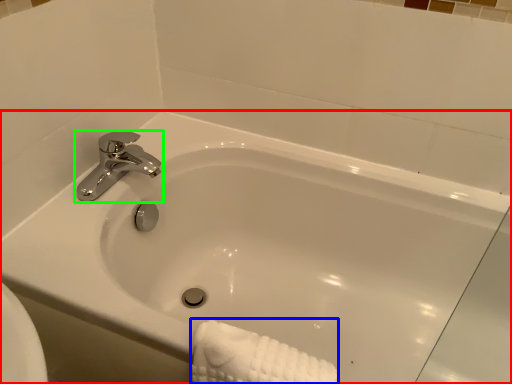
Question: Which is farther away from bathtub (highlighted by a red box)? bath towel (highlighted by a blue box) or tap (highlighted by a green box)?

Choices:
 (A) bath towel
 (B) tap

Answer: (A)